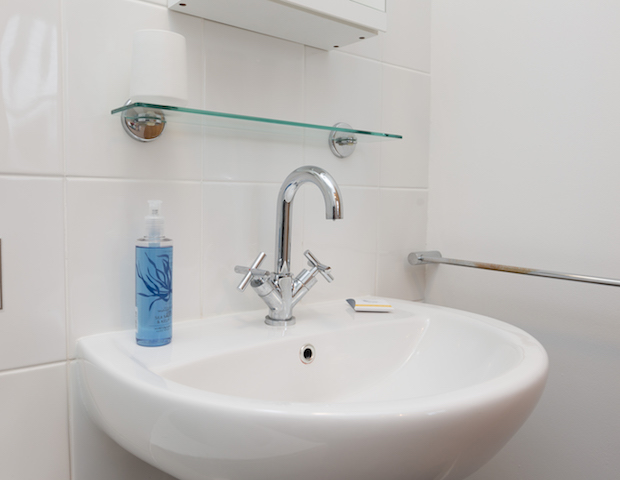
This screenshot has height=480, width=620. Identify the location of sink basin. (353, 399).